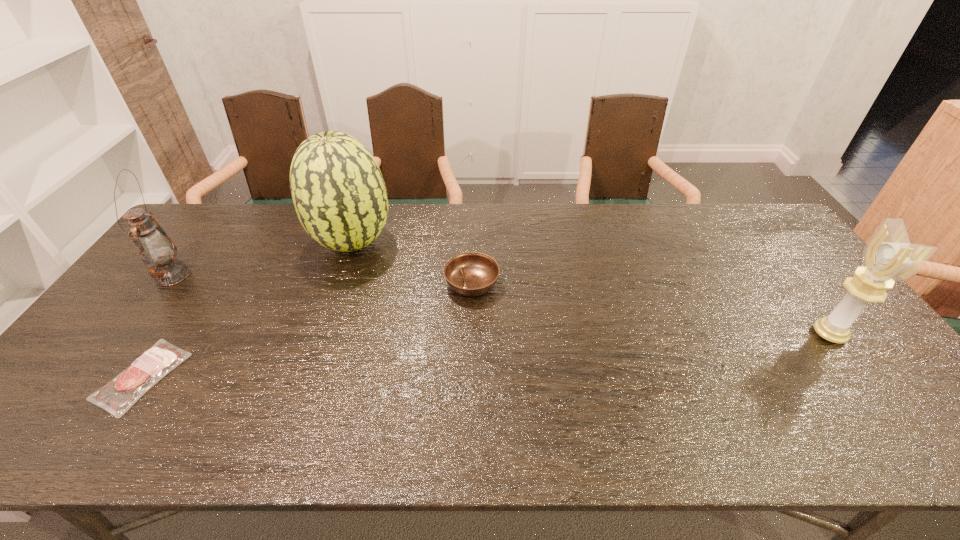
The height and width of the screenshot is (540, 960). What are the coordinates of `vacant space situated 0.370m on the front-facing side of the rightmost object` in the screenshot? It's located at (674, 334).

Where is `free space located 0.110m on the left of the fourth object from left to right`? This screenshot has height=540, width=960. free space located 0.110m on the left of the fourth object from left to right is located at coordinates (407, 284).

Image resolution: width=960 pixels, height=540 pixels. I want to click on free space located 0.300m on the right of the shortest object, so click(x=303, y=376).

The image size is (960, 540). Identify the location of object located in the far edge section of the desktop. (339, 194).

You are a GUI agent. You are given a task and a screenshot of the screen. Output one action in this format:
    pyautogui.click(x=<x>, y=<y>)
    Task: Click on the object that is at the near edge
    The height and width of the screenshot is (540, 960).
    Given the screenshot: What is the action you would take?
    pyautogui.click(x=120, y=394)

This screenshot has width=960, height=540. In order to click on oil lamp that is at the left edge in this screenshot , I will do `click(153, 244)`.

Locate an element on the screen. This screenshot has width=960, height=540. steak that is at the left edge is located at coordinates (120, 394).

I want to click on object located in the right edge section of the desktop, so click(x=888, y=256).

At what (x,y) coordinates should I click in order to perform the action: click on object present at the near left corner. Please return your answer as a coordinate pair (x, y). Image resolution: width=960 pixels, height=540 pixels. Looking at the image, I should click on (120, 394).

I want to click on vacant space at the far edge, so click(465, 221).